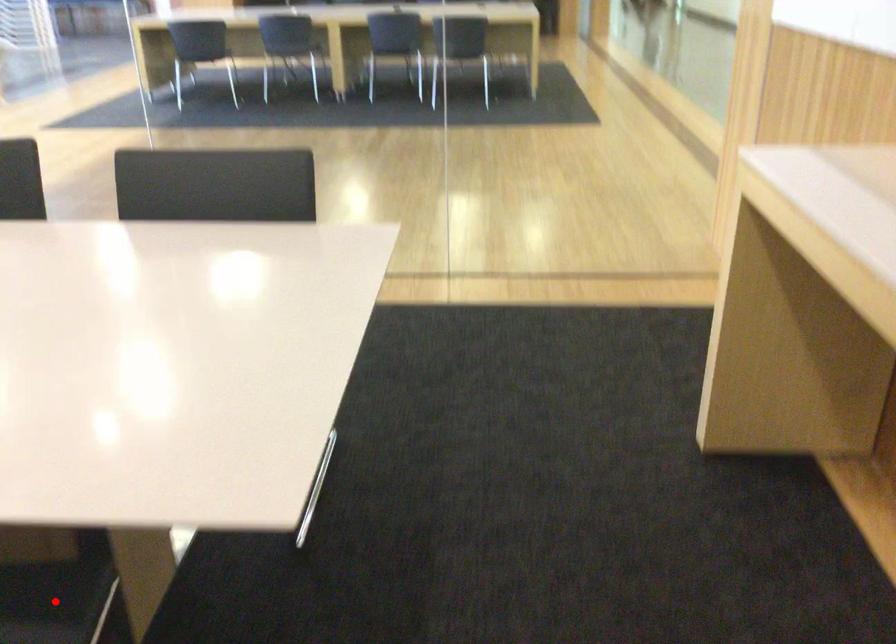
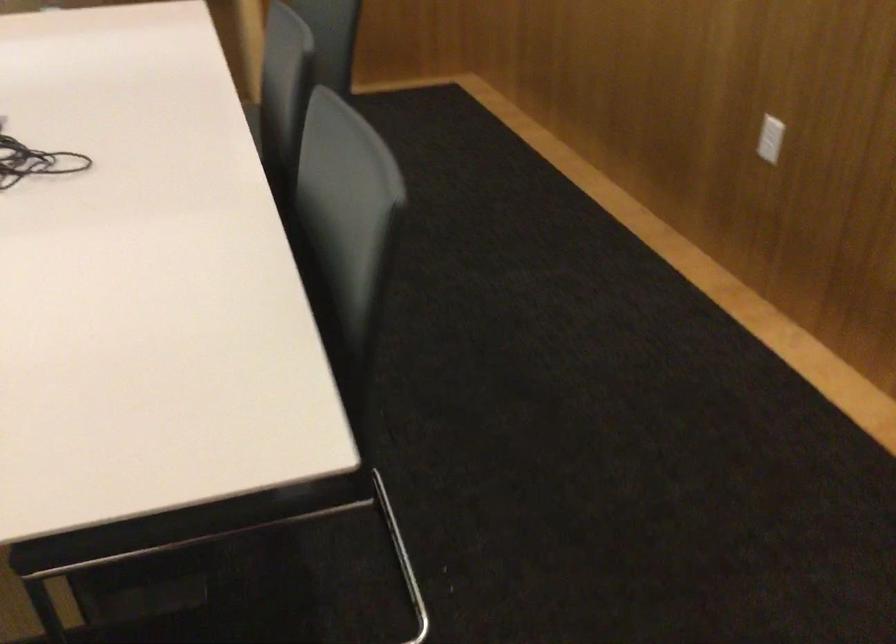
Question: I am providing you with two images of the same scene from different viewpoints. A red point is marked on the first image. Is the red point's position out of view in image 2?

Choices:
 (A) Yes
 (B) No

Answer: (A)